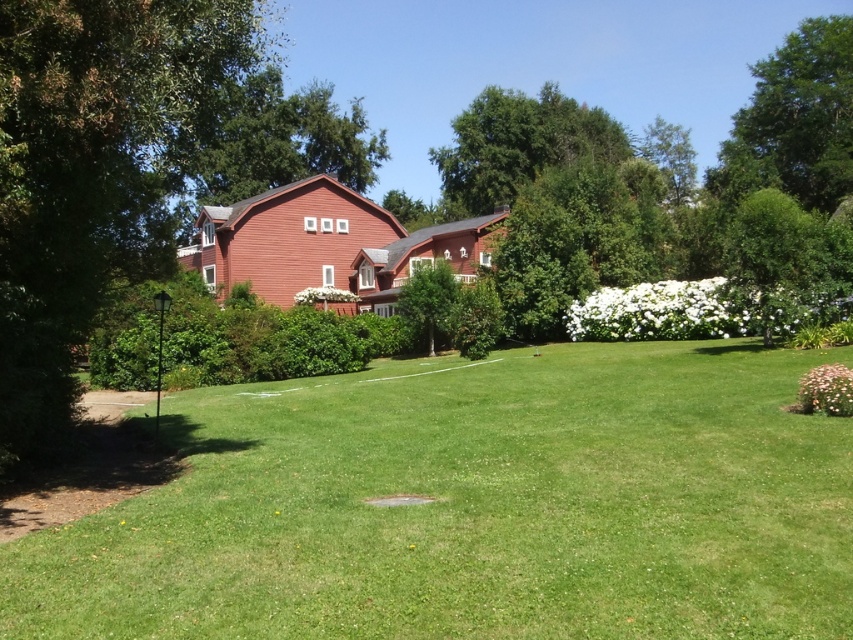
From the picture: Who is shorter, matte red barn at center or green leafy tree at center?

Standing shorter between the two is green leafy tree at center.

Which is in front, point (181, 250) or point (440, 321)?

Positioned in front is point (440, 321).

Does point (242, 260) come closer to viewer compared to point (447, 301)?

No, it is behind (447, 301).

Identify the location of matte red barn at center. The height and width of the screenshot is (640, 853). (287, 240).

At what (x,y) coordinates should I click in order to perform the action: click on green leafy tree at upper right. Please return your answer as a coordinate pair (x, y). The height and width of the screenshot is (640, 853). Looking at the image, I should click on pos(793,120).

Who is higher up, green leafy tree at upper right or green leafy tree at center?

Positioned higher is green leafy tree at upper right.

Between point (785, 76) and point (442, 266), which one is positioned behind?

Point (785, 76)

Find the location of `green leafy tree at upper right`. green leafy tree at upper right is located at coordinates (793, 120).

Is point (741, 120) positioned after point (465, 202)?

That is False.

What do you see at coordinates (793, 120) in the screenshot? Image resolution: width=853 pixels, height=640 pixels. I see `green leafy tree at upper right` at bounding box center [793, 120].

Which is behind, point (718, 182) or point (544, 156)?

The point (544, 156) is behind.

The width and height of the screenshot is (853, 640). What are the coordinates of `green leafy tree at upper right` in the screenshot? It's located at (793, 120).